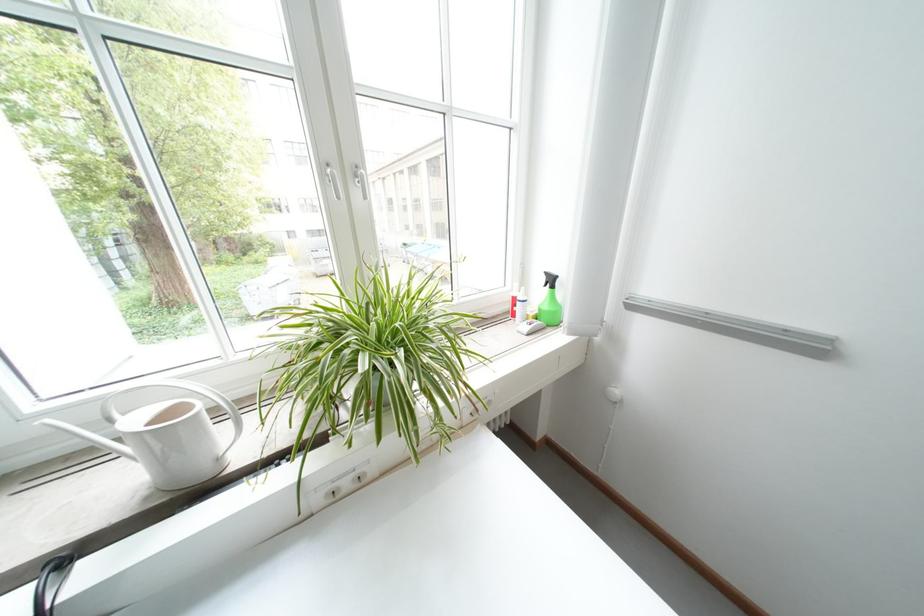
Identify the location of plant pot. (371, 361).